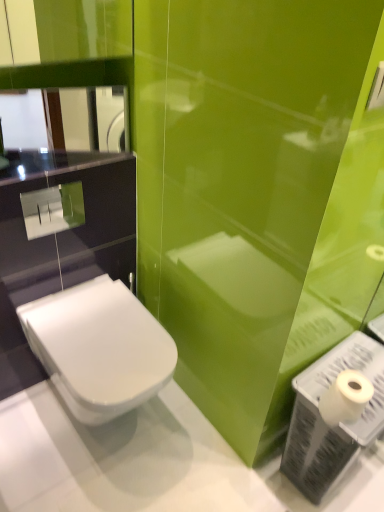
This screenshot has width=384, height=512. I want to click on blank space situated above white glossy toilet at lower left (from a real-world perspective), so click(103, 330).